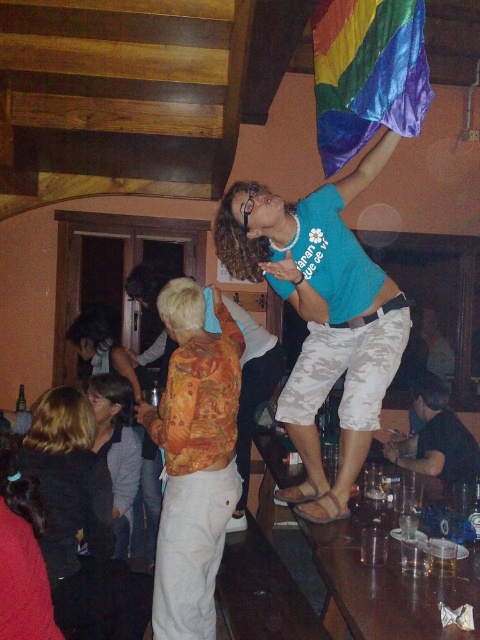
What is the exact coordinate of the black matte shirt at lower right?

The black matte shirt at lower right is located at point (435, 438).